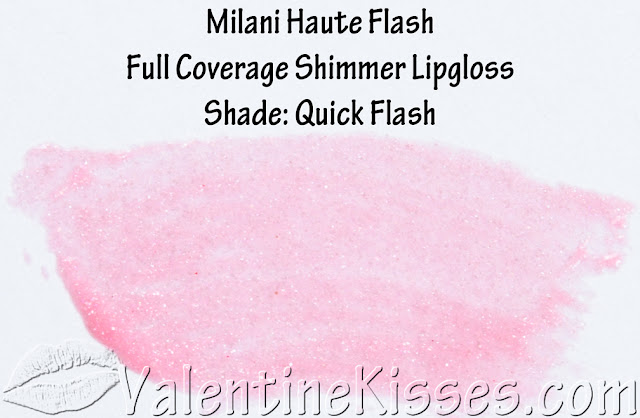
Where is `corner`? This screenshot has height=418, width=640. corner is located at coordinates pos(44,56).